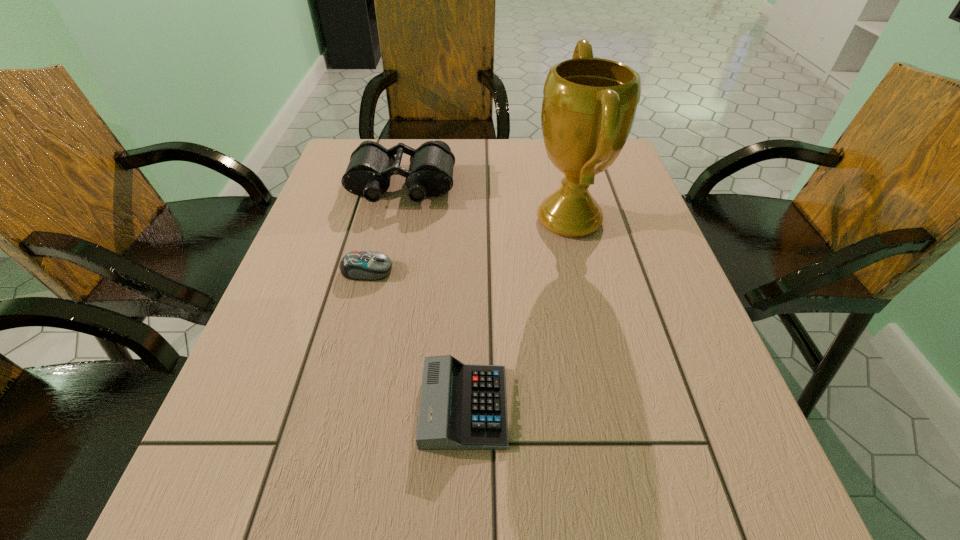
I want to click on free location that satisfies the following two spatial constraints: 1. through the eyepieces of the binoculars; 2. on the wheel side of the computer mouse, so click(x=383, y=271).

At what (x,y) coordinates should I click in order to perform the action: click on free space that satisfies the following two spatial constraints: 1. on the back side of the calculator; 2. on the wheel side of the computer mouse. Please return your answer as a coordinate pair (x, y). Image resolution: width=960 pixels, height=540 pixels. Looking at the image, I should click on pyautogui.click(x=468, y=271).

Image resolution: width=960 pixels, height=540 pixels. In order to click on free space that satisfies the following two spatial constraints: 1. on the back side of the nearest object; 2. on the wheel side of the computer mouse in this screenshot , I will do `click(468, 271)`.

I want to click on free location that satisfies the following two spatial constraints: 1. on the front of the tallest object with the decoration; 2. on the front side of the calculator, so click(x=612, y=406).